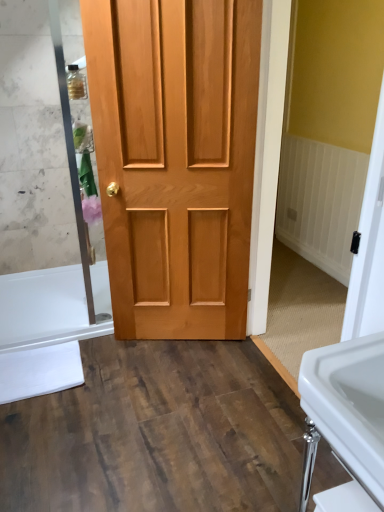
Question: Considering the relative positions of white glossy sink at lower right and white glossy bathtub at lower left in the image provided, is white glossy sink at lower right to the right of white glossy bathtub at lower left from the viewer's perspective?

Choices:
 (A) no
 (B) yes

Answer: (B)

Question: Is white glossy sink at lower right surrounding white glossy bathtub at lower left?

Choices:
 (A) yes
 (B) no

Answer: (B)

Question: Is white glossy sink at lower right outside of white glossy bathtub at lower left?

Choices:
 (A) no
 (B) yes

Answer: (B)

Question: Is white glossy sink at lower right closer to the viewer compared to white glossy bathtub at lower left?

Choices:
 (A) no
 (B) yes

Answer: (B)

Question: Can you confirm if white glossy sink at lower right is shorter than white glossy bathtub at lower left?

Choices:
 (A) yes
 (B) no

Answer: (B)

Question: Is white glossy sink at lower right spatially inside natural wood door at center, or outside of it?

Choices:
 (A) inside
 (B) outside

Answer: (B)

Question: Considering the positions of white glossy sink at lower right and natural wood door at center in the image, is white glossy sink at lower right taller or shorter than natural wood door at center?

Choices:
 (A) tall
 (B) short

Answer: (B)

Question: Looking at their shapes, would you say white glossy sink at lower right is wider or thinner than natural wood door at center?

Choices:
 (A) thin
 (B) wide

Answer: (B)

Question: From a real-world perspective, relative to natural wood door at center, is white glossy sink at lower right vertically above or below?

Choices:
 (A) below
 (B) above

Answer: (A)

Question: Does point (304, 373) appear closer or farther from the camera than point (8, 300)?

Choices:
 (A) closer
 (B) farther

Answer: (A)

Question: Looking at the image, does white glossy sink at lower right seem bigger or smaller compared to white glossy bathtub at lower left?

Choices:
 (A) big
 (B) small

Answer: (A)

Question: Looking at their shapes, would you say white glossy sink at lower right is wider or thinner than white glossy bathtub at lower left?

Choices:
 (A) thin
 (B) wide

Answer: (A)

Question: Do you think white glossy sink at lower right is within white glossy bathtub at lower left, or outside of it?

Choices:
 (A) inside
 (B) outside

Answer: (B)

Question: Looking at their shapes, would you say white glossy bathtub at lower left is wider or thinner than natural wood door at center?

Choices:
 (A) wide
 (B) thin

Answer: (A)

Question: Relative to natural wood door at center, is white glossy bathtub at lower left in front or behind?

Choices:
 (A) behind
 (B) front

Answer: (A)